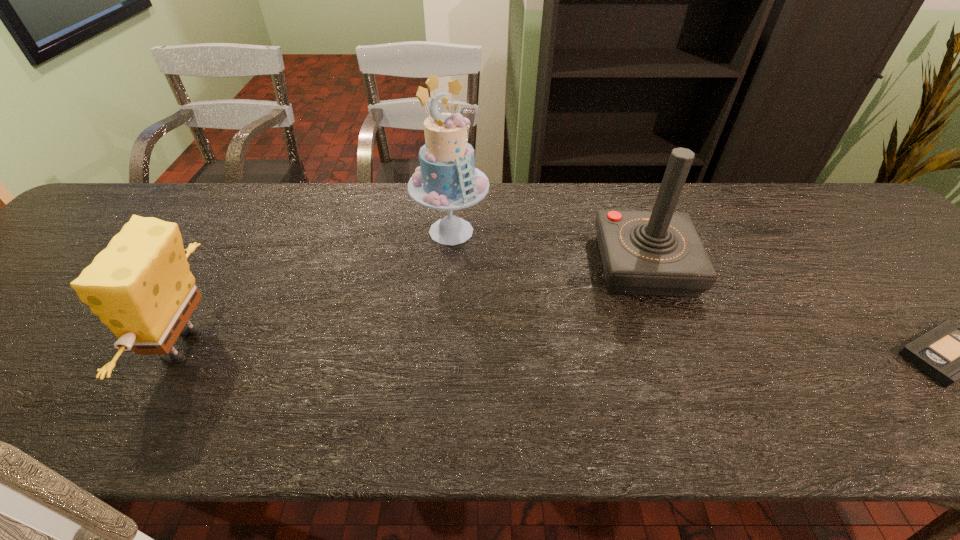
Locate an element on the screen. sponge is located at coordinates click(x=140, y=286).

Where is `the tallest object`? Image resolution: width=960 pixels, height=540 pixels. the tallest object is located at coordinates (447, 179).

The image size is (960, 540). I want to click on cake, so click(447, 179).

Locate an element on the screen. This screenshot has height=540, width=960. the second object from right to left is located at coordinates (659, 253).

Find the location of a particular element. vacant space situated on the face of the sponge is located at coordinates (86, 346).

This screenshot has width=960, height=540. Find the location of `vacant space located 0.180m on the face of the sponge`. vacant space located 0.180m on the face of the sponge is located at coordinates (68, 346).

Locate an element on the screen. The width and height of the screenshot is (960, 540). free space located 0.300m on the face of the sponge is located at coordinates (12, 346).

Image resolution: width=960 pixels, height=540 pixels. Find the location of `free space located with a ladder on the side of the tallest object`. free space located with a ladder on the side of the tallest object is located at coordinates (464, 336).

This screenshot has height=540, width=960. I want to click on vacant area situated with a ladder on the side of the tallest object, so [x=463, y=329].

At what (x,y) coordinates should I click in order to perform the action: click on vacant area situated 0.300m with a ladder on the side of the tallest object. Please return your answer as a coordinate pair (x, y). The height and width of the screenshot is (540, 960). Looking at the image, I should click on (466, 352).